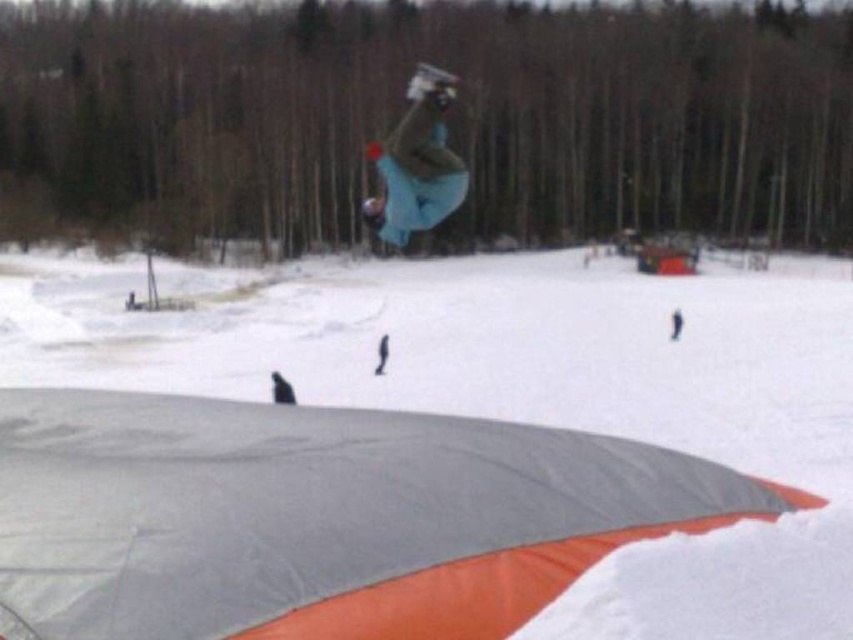
Question: From the image, what is the correct spatial relationship of white matte snow at center in relation to blue fabric snowboarder at center?

Choices:
 (A) left
 (B) right

Answer: (B)

Question: Among these points, which one is farthest from the camera?

Choices:
 (A) (469, 378)
 (B) (393, 243)

Answer: (A)

Question: Can you confirm if white matte snow at center is positioned below blue fabric snowboarder at center?

Choices:
 (A) no
 (B) yes

Answer: (B)

Question: Which of the following is the closest to the observer?

Choices:
 (A) white matte snow at center
 (B) blue fabric snowboarder at center

Answer: (A)

Question: Does white matte snow at center have a larger size compared to blue fabric snowboarder at center?

Choices:
 (A) yes
 (B) no

Answer: (A)